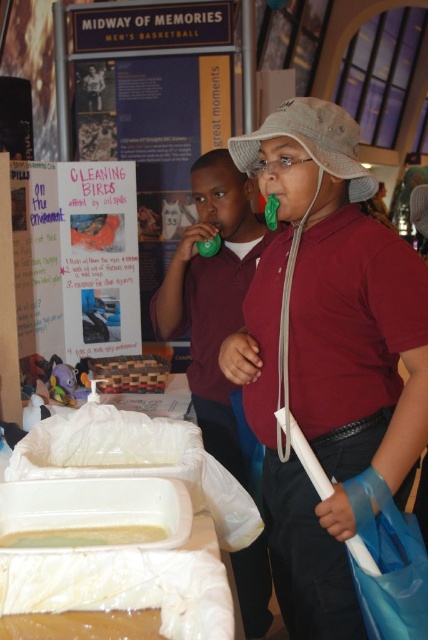
Between green rubber whistle at center and translucent plastic container at center, which one appears on the left side from the viewer's perspective?

translucent plastic container at center is more to the left.

Which of these two, green rubber whistle at center or translucent plastic container at center, stands taller?

green rubber whistle at center is taller.

Which is in front, point (214, 268) or point (112, 540)?

Point (112, 540) is more forward.

You are a GUI agent. You are given a task and a screenshot of the screen. Output one action in this format:
    pyautogui.click(x=<x>, y=<y>)
    Task: Click on the green rubber whistle at center
    The height and width of the screenshot is (640, 428).
    Given the screenshot: What is the action you would take?
    pyautogui.click(x=211, y=296)

Locate an element on the screen. This screenshot has width=428, height=640. green rubber whistle at center is located at coordinates (211, 296).

Based on the photo, does green rubber whistle at center come in front of wooden blocks at center?

Yes, it is in front of wooden blocks at center.

Between point (255, 228) and point (145, 378), which one is positioned in front?

Point (255, 228) is in front.

Identify the location of green rubber whistle at center. (211, 296).

Is matte green whistle at center to the right of translucent plastic container at center from the viewer's perspective?

Correct, you'll find matte green whistle at center to the right of translucent plastic container at center.

Does point (303, 522) come farther from viewer compared to point (163, 538)?

Yes.

Identify the location of matte green whistle at center. The image size is (428, 640). (326, 356).